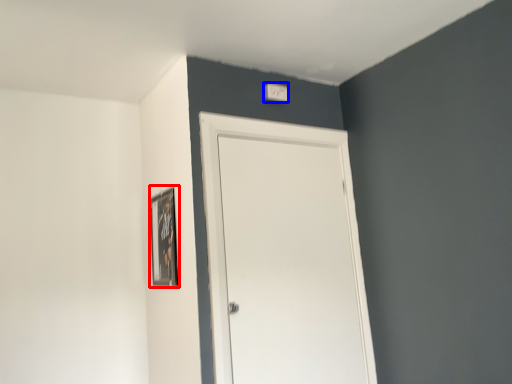
Question: Which point is closer to the camera, picture frame (highlighted by a red box) or light switch (highlighted by a blue box)?

Choices:
 (A) picture frame
 (B) light switch

Answer: (A)